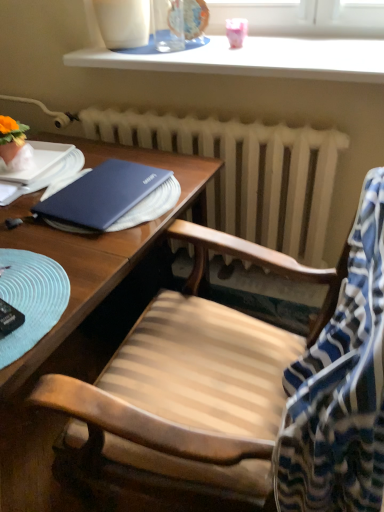
Question: Is blue striped fabric at right positioned before white glossy window sill at upper center?

Choices:
 (A) no
 (B) yes

Answer: (B)

Question: Would you say white glossy window sill at upper center is part of blue striped fabric at right's contents?

Choices:
 (A) yes
 (B) no

Answer: (B)

Question: Is blue striped fabric at right oriented away from white glossy window sill at upper center?

Choices:
 (A) yes
 (B) no

Answer: (B)

Question: Is blue striped fabric at right positioned far away from white glossy window sill at upper center?

Choices:
 (A) yes
 (B) no

Answer: (B)

Question: Is blue striped fabric at right at the left side of white glossy window sill at upper center?

Choices:
 (A) yes
 (B) no

Answer: (B)

Question: Considering their positions, is blue striped fabric at right located in front of or behind wooden desk at center?

Choices:
 (A) front
 (B) behind

Answer: (A)

Question: Does point (291, 397) appear closer or farther from the camera than point (94, 337)?

Choices:
 (A) closer
 (B) farther

Answer: (A)

Question: In terms of height, does blue striped fabric at right look taller or shorter compared to wooden desk at center?

Choices:
 (A) short
 (B) tall

Answer: (A)

Question: From a real-world perspective, is blue striped fabric at right above or below wooden desk at center?

Choices:
 (A) above
 (B) below

Answer: (A)

Question: Is white matte radiator at center inside the boundaries of wooden desk at center, or outside?

Choices:
 (A) outside
 (B) inside

Answer: (A)

Question: Visually, is white matte radiator at center positioned to the left or to the right of wooden desk at center?

Choices:
 (A) left
 (B) right

Answer: (B)

Question: Is white matte radiator at center wider or thinner than wooden desk at center?

Choices:
 (A) thin
 (B) wide

Answer: (A)

Question: In the image, is white matte radiator at center positioned in front of or behind wooden desk at center?

Choices:
 (A) behind
 (B) front

Answer: (A)

Question: In terms of width, does wooden chair at center look wider or thinner when compared to white glossy window sill at upper center?

Choices:
 (A) thin
 (B) wide

Answer: (B)

Question: Visually, is wooden chair at center positioned to the left or to the right of white glossy window sill at upper center?

Choices:
 (A) right
 (B) left

Answer: (B)